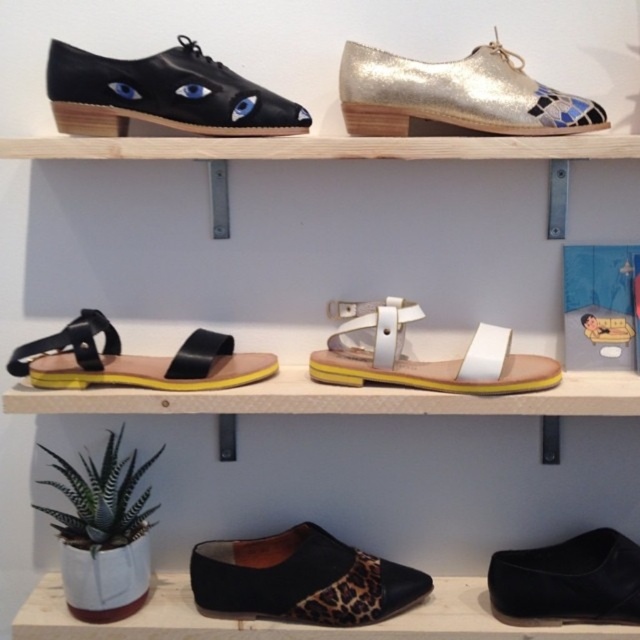
You are standing in front of the footwear display and want to reach a point that is closer to you. Which point should you aim for, point (413, 385) or point (609, 538)?

You should aim for point (413, 385) because it is closer to the viewer than point (609, 538).

You are standing in front of a display of footwear arranged on wooden shelves. You see a white leather sandal at center. Can you reach it without moving closer?

The white leather sandal at center is 1.01 meters away from viewer, so you cannot reach it without moving closer.